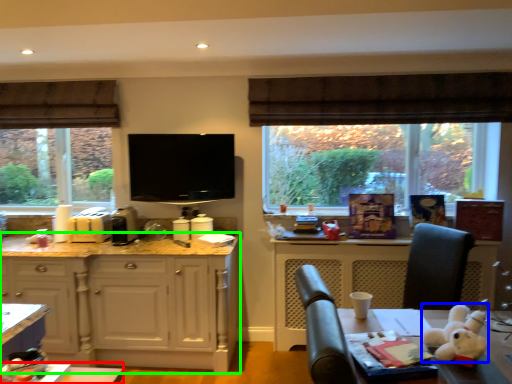
Question: Considering the real-world distances, which object is farthest from table (highlighted by a red box)? animal (highlighted by a blue box) or cabinetry (highlighted by a green box)?

Choices:
 (A) animal
 (B) cabinetry

Answer: (A)